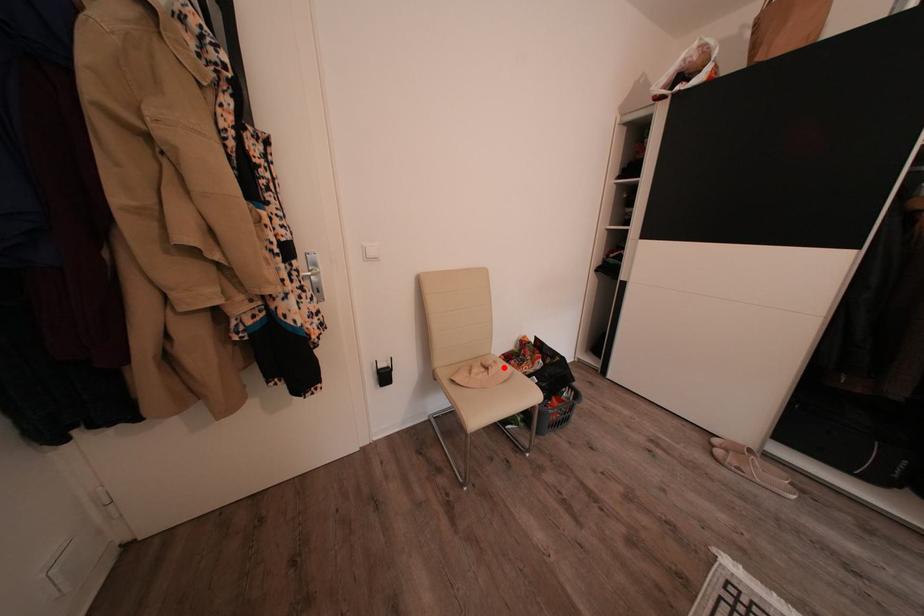
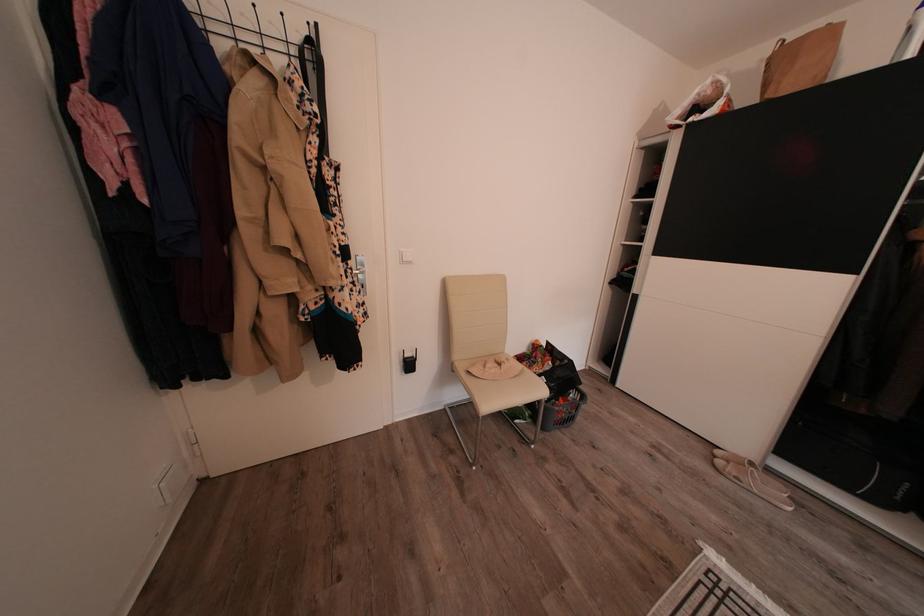
Question: I am providing you with two images of the same scene from different viewpoints. In image1, a red point is highlighted. Considering the same 3D point in image2, which of the following is correct?

Choices:
 (A) It is closer
 (B) It is farther

Answer: (B)